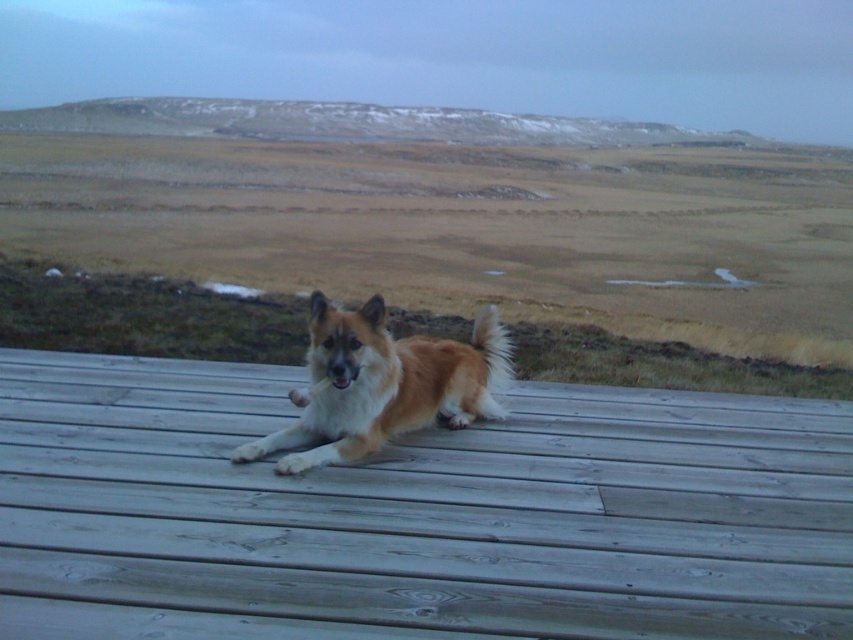
Question: Which of the following is the closest to the observer?

Choices:
 (A) wooden deck at center
 (B) golden fur dog at center

Answer: (A)

Question: Which point is closer to the camera?

Choices:
 (A) (277, 488)
 (B) (469, 419)

Answer: (A)

Question: Is brown fur dog at center positioned behind golden fur dog at center?

Choices:
 (A) yes
 (B) no

Answer: (A)

Question: Is the position of wooden deck at center more distant than that of brown fur dog at center?

Choices:
 (A) no
 (B) yes

Answer: (A)

Question: Which point is closer to the camera taking this photo?

Choices:
 (A) (381, 381)
 (B) (495, 550)
 (C) (344, 252)

Answer: (B)

Question: From the image, what is the correct spatial relationship of brown fur dog at center in relation to golden fur dog at center?

Choices:
 (A) above
 (B) below

Answer: (A)